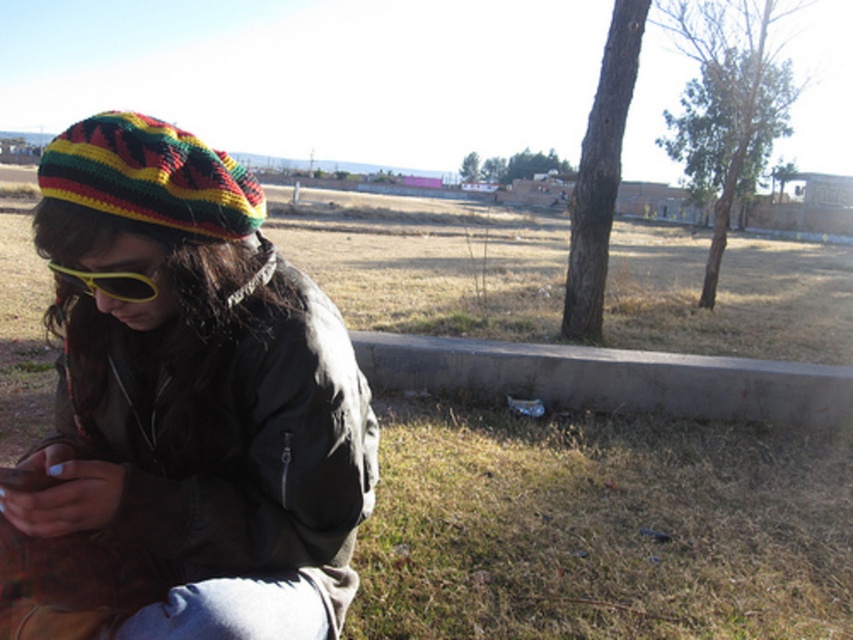
You are a delivery person who needs to place a small package on the gray concrete curb at lower center. However, there is a yellow matte sunglasses at lower left nearby. Since the sunglasses are fragile, you want to ensure they won not be crushed by the package. Based on the scene, can you safely place the package on the curb without risking the sunglasses?

The gray concrete curb at lower center is taller than the yellow matte sunglasses at lower left. Since the curb is taller, placing the package on it would keep it elevated above the sunglasses, so the sunglasses would not be crushed by the package.